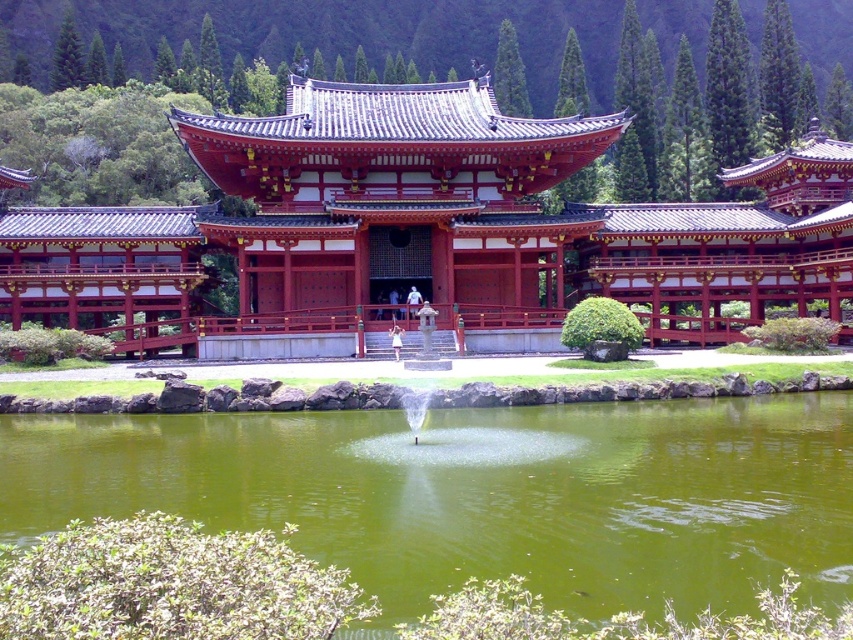
Question: Which point is closer to the camera?

Choices:
 (A) (363, 472)
 (B) (253, 148)

Answer: (A)

Question: Which object is farther from the camera taking this photo?

Choices:
 (A) green liquid water at center
 (B) matte red pagoda at center

Answer: (B)

Question: From the image, what is the correct spatial relationship of matte red pagoda at center in relation to green liquid water at center?

Choices:
 (A) above
 (B) below

Answer: (A)

Question: Is matte red pagoda at center to the left of green liquid water at center from the viewer's perspective?

Choices:
 (A) yes
 (B) no

Answer: (A)

Question: Does matte red pagoda at center appear on the right side of green liquid water at center?

Choices:
 (A) no
 (B) yes

Answer: (A)